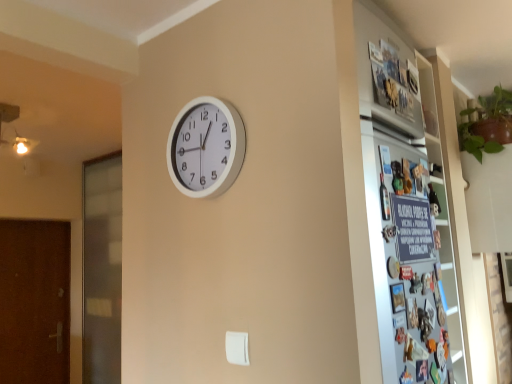
Question: Is the surface of transparent glass screen door at left, positioned as the 1th screen door in right-to-left order, in direct contact with white plastic wall clock at center?

Choices:
 (A) no
 (B) yes

Answer: (A)

Question: Can you confirm if transparent glass screen door at left, which is the 2th screen door in left-to-right order, is shorter than white plastic wall clock at center?

Choices:
 (A) yes
 (B) no

Answer: (B)

Question: Considering the relative positions of transparent glass screen door at left, which is the 2th screen door in left-to-right order, and white plastic wall clock at center in the image provided, is transparent glass screen door at left, which is the 2th screen door in left-to-right order, to the left of white plastic wall clock at center from the viewer's perspective?

Choices:
 (A) no
 (B) yes

Answer: (B)

Question: Can you confirm if transparent glass screen door at left, positioned as the 1th screen door in right-to-left order, is positioned to the right of white plastic wall clock at center?

Choices:
 (A) no
 (B) yes

Answer: (A)

Question: Can you confirm if transparent glass screen door at left, which is the 2th screen door in left-to-right order, is smaller than white plastic wall clock at center?

Choices:
 (A) yes
 (B) no

Answer: (B)

Question: Is transparent glass screen door at left, positioned as the 1th screen door in right-to-left order, positioned before white plastic wall clock at center?

Choices:
 (A) no
 (B) yes

Answer: (A)

Question: From the image's perspective, would you say brown textured door at left, the 1th screen door when ordered from left to right, is positioned over white plastic wall clock at center?

Choices:
 (A) no
 (B) yes

Answer: (A)

Question: Considering the relative sizes of brown textured door at left, the 1th screen door when ordered from left to right, and white plastic wall clock at center in the image provided, is brown textured door at left, the 1th screen door when ordered from left to right, thinner than white plastic wall clock at center?

Choices:
 (A) yes
 (B) no

Answer: (B)

Question: Considering the relative sizes of brown textured door at left, the 1th screen door when ordered from left to right, and white plastic wall clock at center in the image provided, is brown textured door at left, the 1th screen door when ordered from left to right, smaller than white plastic wall clock at center?

Choices:
 (A) yes
 (B) no

Answer: (B)

Question: Is brown textured door at left, the 2th screen door in the right-to-left sequence, oriented towards white plastic wall clock at center?

Choices:
 (A) no
 (B) yes

Answer: (B)

Question: Is white plastic wall clock at center surrounded by brown textured door at left, the 1th screen door when ordered from left to right?

Choices:
 (A) no
 (B) yes

Answer: (A)

Question: Is brown textured door at left, the 1th screen door when ordered from left to right, not close to white plastic wall clock at center?

Choices:
 (A) no
 (B) yes

Answer: (B)

Question: Is brown textured door at left, the 1th screen door when ordered from left to right, located within metallic silver fridge at right?

Choices:
 (A) yes
 (B) no

Answer: (B)